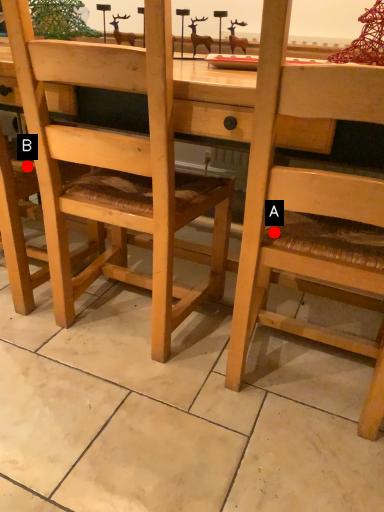
Question: Two points are circled on the image, labeled by A and B beside each circle. Which point is farther from the camera taking this photo?

Choices:
 (A) A is further
 (B) B is further

Answer: (B)